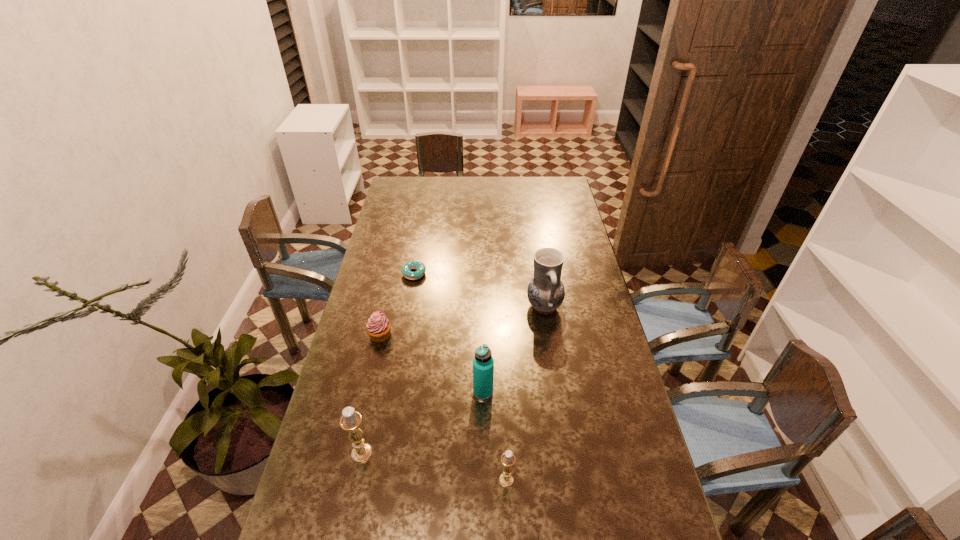
Find the location of a particular element. vacant spot to place a candle holder on the right is located at coordinates (665, 509).